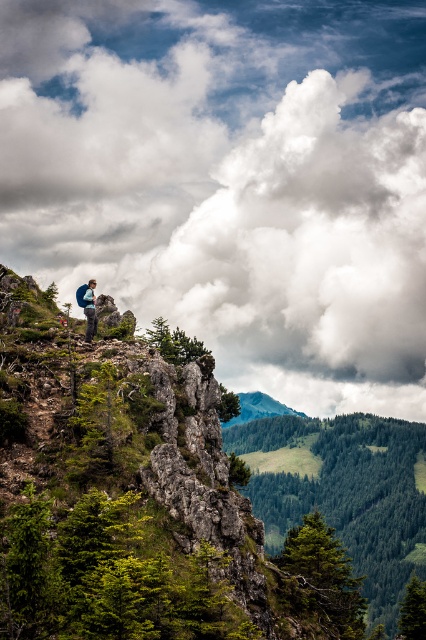
Question: Is green grassy mountain at center above matte blue backpack at center?

Choices:
 (A) no
 (B) yes

Answer: (A)

Question: Which of the following is the farthest from the observer?

Choices:
 (A) (256, 397)
 (B) (91, 291)
 (C) (374, 416)

Answer: (A)

Question: Which point appears farthest from the camera in this image?

Choices:
 (A) (282, 412)
 (B) (383, 64)

Answer: (B)

Question: Is white fluffy cloud at upper center to the right of green grassy mountain at center from the viewer's perspective?

Choices:
 (A) no
 (B) yes

Answer: (A)

Question: Is green grassy hillside at center below green grassy mountain at center?

Choices:
 (A) yes
 (B) no

Answer: (A)

Question: Estimate the real-world distances between objects in this image. Which object is farther from the green grassy mountain at center?

Choices:
 (A) green grassy hillside at center
 (B) matte blue backpack at center
 (C) white fluffy cloud at upper center

Answer: (B)